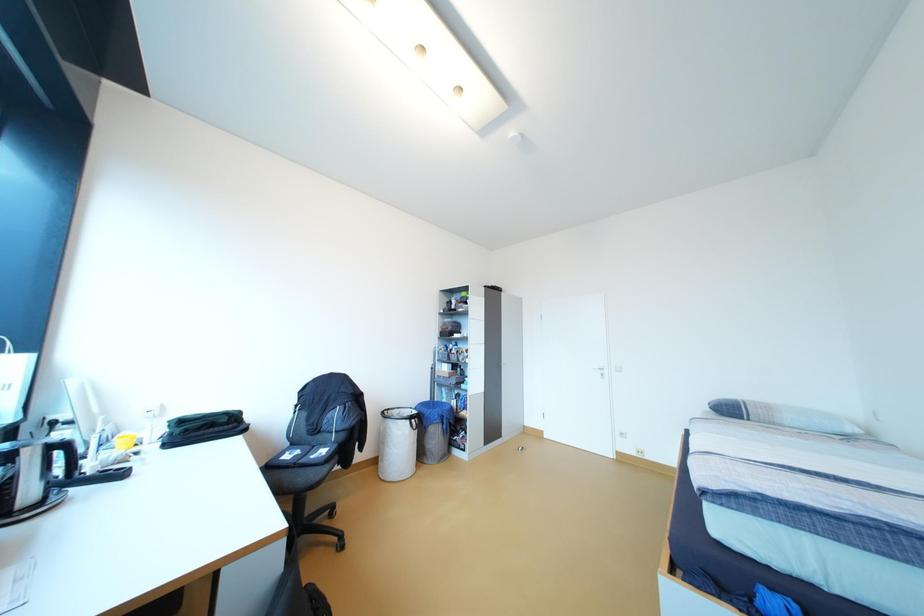
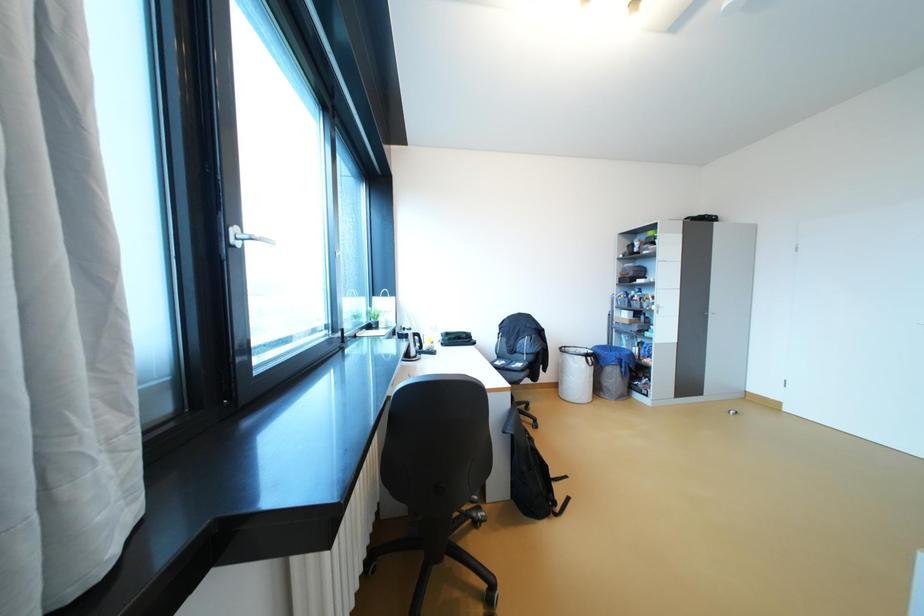
Question: How did the camera likely rotate?

Choices:
 (A) Left
 (B) Right
 (C) Up
 (D) Down

Answer: (A)